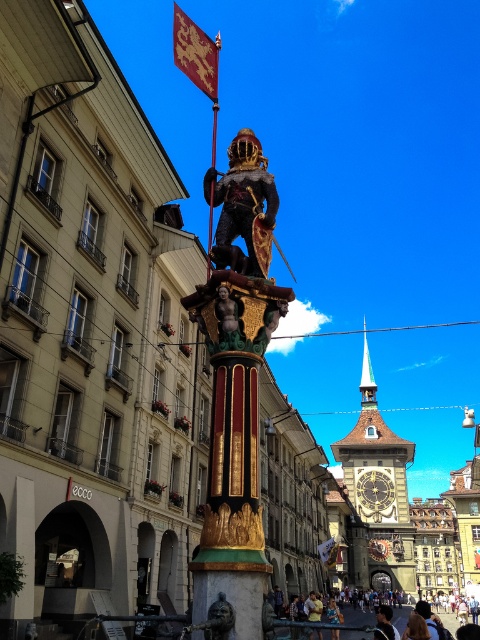
Does shiny dark armor at center appear under gold metallic clock at center?

Actually, shiny dark armor at center is above gold metallic clock at center.

This screenshot has width=480, height=640. Find the location of `shiny dark armor at center`. shiny dark armor at center is located at coordinates (243, 204).

Does gold textured flag at upper center have a lesser height compared to gold textured flag at center?

In fact, gold textured flag at upper center may be taller than gold textured flag at center.

Locate an element on the screen. The width and height of the screenshot is (480, 640). gold textured flag at upper center is located at coordinates (194, 52).

This screenshot has width=480, height=640. I want to click on gold textured flag at upper center, so click(194, 52).

You are a GUI agent. You are given a task and a screenshot of the screen. Output one action in this format:
    pyautogui.click(x=<x>, y=<y>)
    Task: Click on the gold textured flag at upper center
    
    Given the screenshot: What is the action you would take?
    pyautogui.click(x=194, y=52)

How far apart are gold textured flag at upper center and golden textured statue at center?

gold textured flag at upper center is 84.47 meters from golden textured statue at center.

Measure the distance between gold textured flag at upper center and camera.

The distance of gold textured flag at upper center from camera is 73.52 feet.

Identify the location of gold textured flag at upper center. Image resolution: width=480 pixels, height=640 pixels. (194, 52).